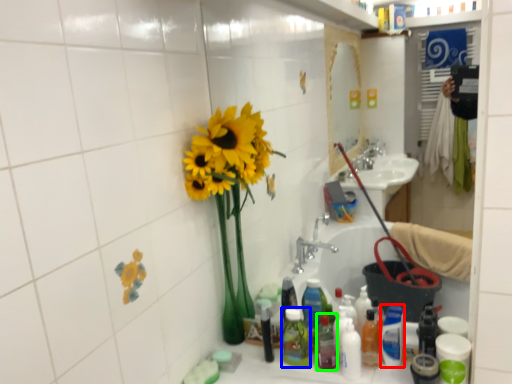
Question: Considering the real-world distances, which object is farthest from cleaning product (highlighted by a red box)? toiletry (highlighted by a blue box) or bottle (highlighted by a green box)?

Choices:
 (A) toiletry
 (B) bottle

Answer: (A)